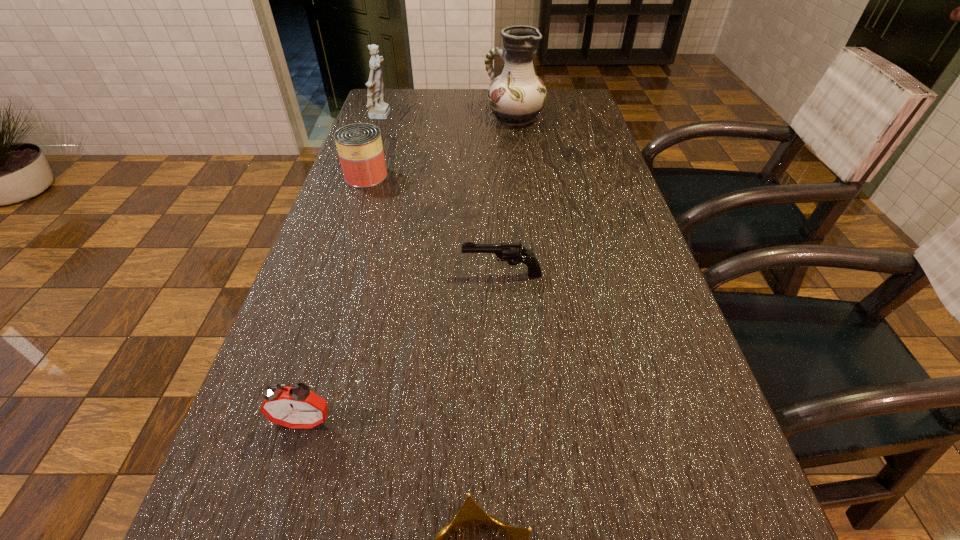
At what (x,y) coordinates should I click in order to perform the action: click on vacant region that satisfies the following two spatial constraints: 1. on the front-facing side of the second tallest object; 2. on the left side of the fourth nearest object. Please return your answer as a coordinate pair (x, y). The image size is (960, 540). Looking at the image, I should click on (362, 176).

Where is `free spot that satisfies the following two spatial constraints: 1. on the back side of the can; 2. on the right side of the vase`? free spot that satisfies the following two spatial constraints: 1. on the back side of the can; 2. on the right side of the vase is located at coordinates (385, 118).

Identify the location of vacant space that satisfies the following two spatial constraints: 1. on the front-facing side of the fifth shortest object; 2. on the right side of the vase. This screenshot has height=540, width=960. (382, 118).

What are the coordinates of `vacant area in the image that satisfies the following two spatial constraints: 1. on the front-facing side of the fifth shortest object; 2. on the left side of the vase` in the screenshot? It's located at (382, 118).

Identify the location of free space that satisfies the following two spatial constraints: 1. on the front-facing side of the figurine; 2. on the right side of the fourth nearest object. (362, 176).